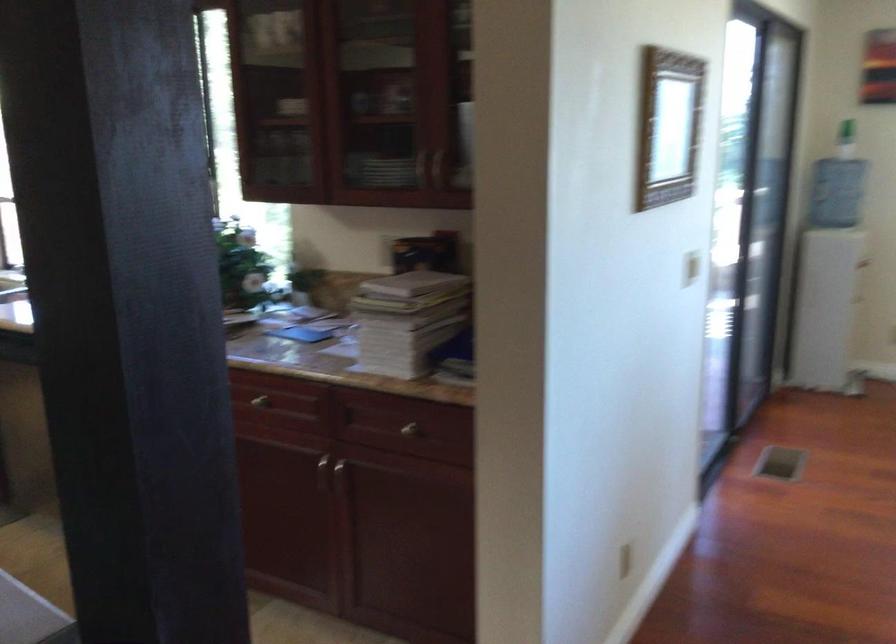
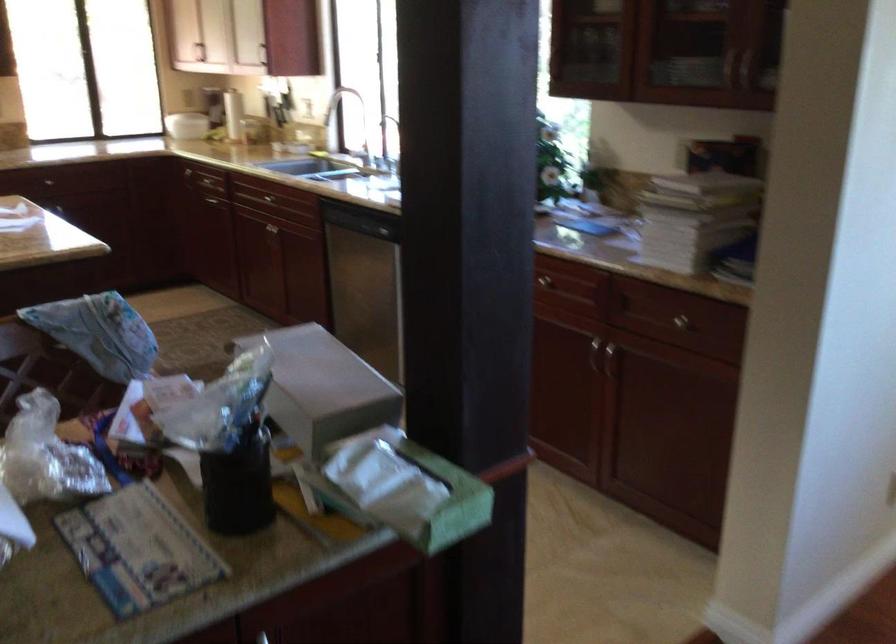
In the second image, find the point that corresponds to the point at 316,474 in the first image.

(593, 355)